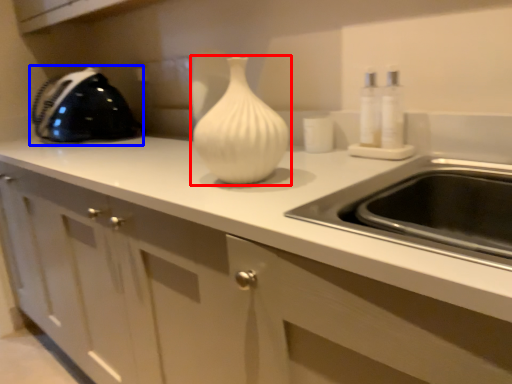
Question: Which point is closer to the camera, vase (highlighted by a red box) or appliance (highlighted by a blue box)?

Choices:
 (A) vase
 (B) appliance

Answer: (A)